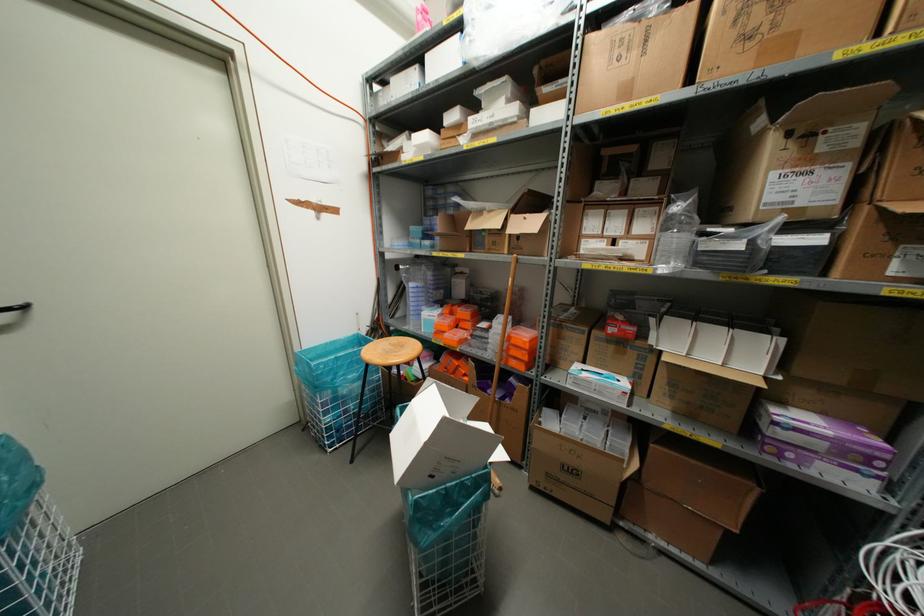
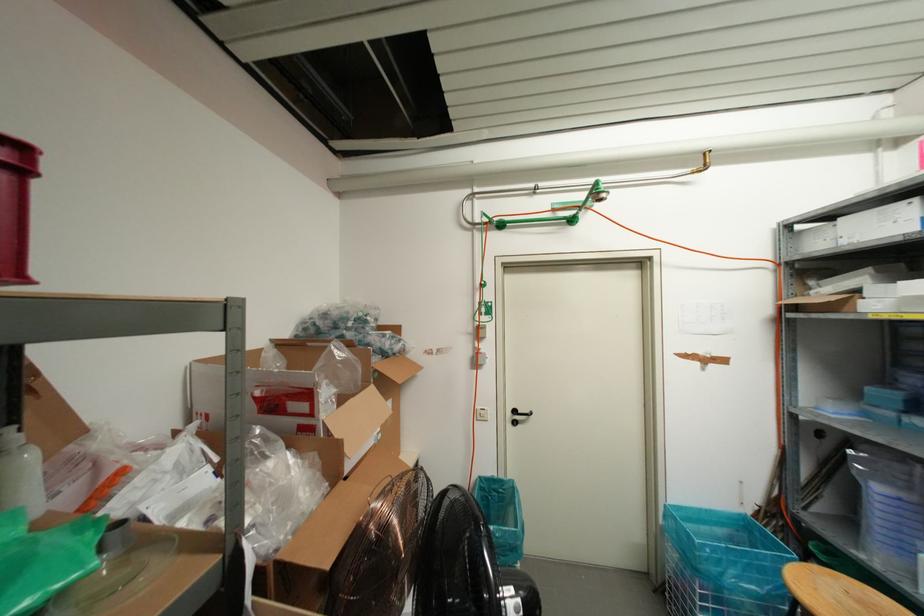
Question: The images are taken continuously from a first-person perspective. In which direction is your viewpoint rotating?

Choices:
 (A) Left
 (B) Right
 (C) Up
 (D) Down

Answer: (A)